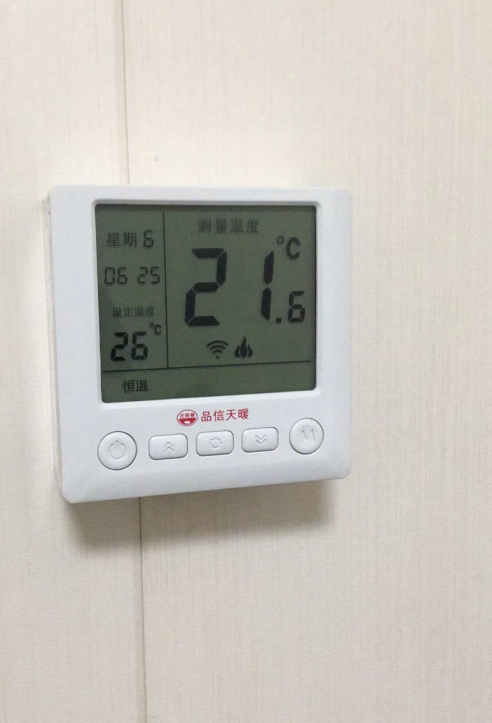
The width and height of the screenshot is (492, 723). Find the location of `wall to left of thermostat`. wall to left of thermostat is located at coordinates [x=36, y=348].